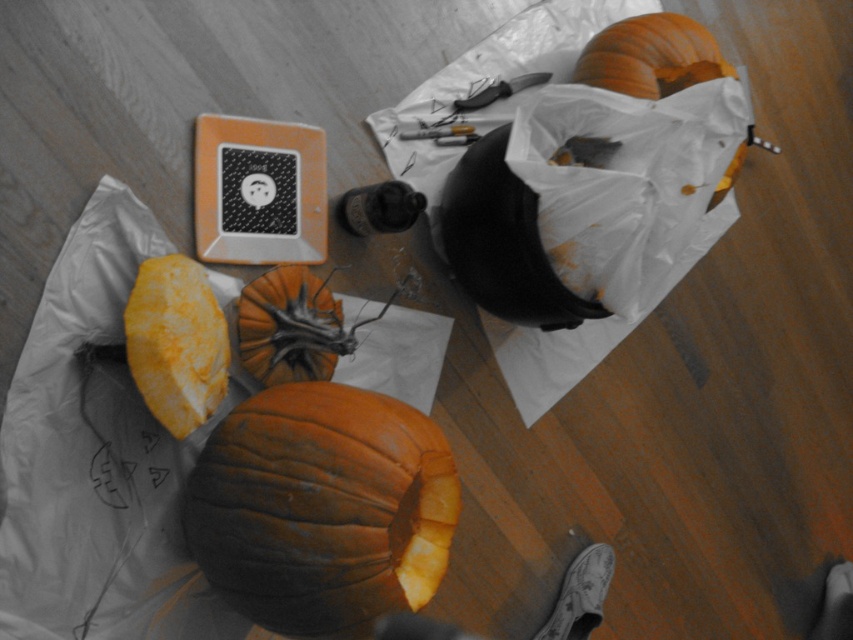
This screenshot has width=853, height=640. I want to click on orange rough pumpkin at center, so click(289, 326).

Describe the element at coordinates (289, 326) in the screenshot. Image resolution: width=853 pixels, height=640 pixels. I see `orange rough pumpkin at center` at that location.

What do you see at coordinates (289, 326) in the screenshot? This screenshot has width=853, height=640. I see `orange rough pumpkin at center` at bounding box center [289, 326].

The width and height of the screenshot is (853, 640). What are the coordinates of `orange rough pumpkin at center` in the screenshot? It's located at (289, 326).

Which of these two, orange matte pumpkin at lower left or orange rough pumpkin at center, stands shorter?

Standing shorter between the two is orange rough pumpkin at center.

Is point (155, 339) less distant than point (273, 365)?

Yes, point (155, 339) is closer to viewer.

This screenshot has height=640, width=853. What are the coordinates of `orange matte pumpkin at lower left` in the screenshot? It's located at (177, 342).

Which is more to the left, orange matte pumpkin at lower left or orange matte pumpkin at upper right?

From the viewer's perspective, orange matte pumpkin at lower left appears more on the left side.

Locate an element on the screen. This screenshot has width=853, height=640. orange matte pumpkin at lower left is located at coordinates (177, 342).